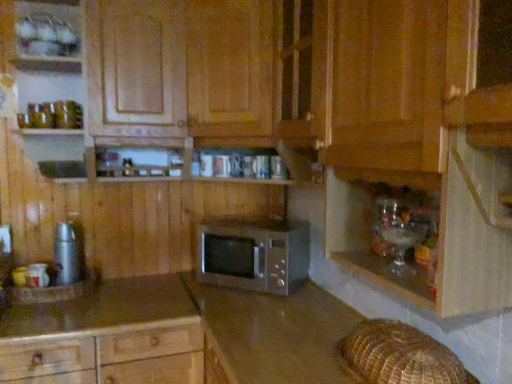
Question: Is satin silver microwave at center inside or outside of smooth brown countertop at lower left?

Choices:
 (A) inside
 (B) outside

Answer: (B)

Question: From the image's perspective, relative to smooth brown countertop at lower left, is satin silver microwave at center above or below?

Choices:
 (A) below
 (B) above

Answer: (B)

Question: Which object is positioned closest to the satin silver microwave at center?

Choices:
 (A) smooth brown countertop at lower left
 (B) metallic silver thermos at left
 (C) wooden microwave at center, marked as the 2th cabinetry in a bottom-to-top arrangement
 (D) satin brown microwave at center, acting as the second cabinetry starting from the top
 (E) translucent glassware at lower right

Answer: (D)

Question: Which is nearer to the metallic silver thermos at left?

Choices:
 (A) satin silver microwave at center
 (B) satin brown microwave at center, acting as the second cabinetry starting from the top
 (C) smooth brown countertop at lower left
 (D) translucent glassware at lower right
 (E) wooden microwave at center, marked as the 2th cabinetry in a bottom-to-top arrangement

Answer: (C)